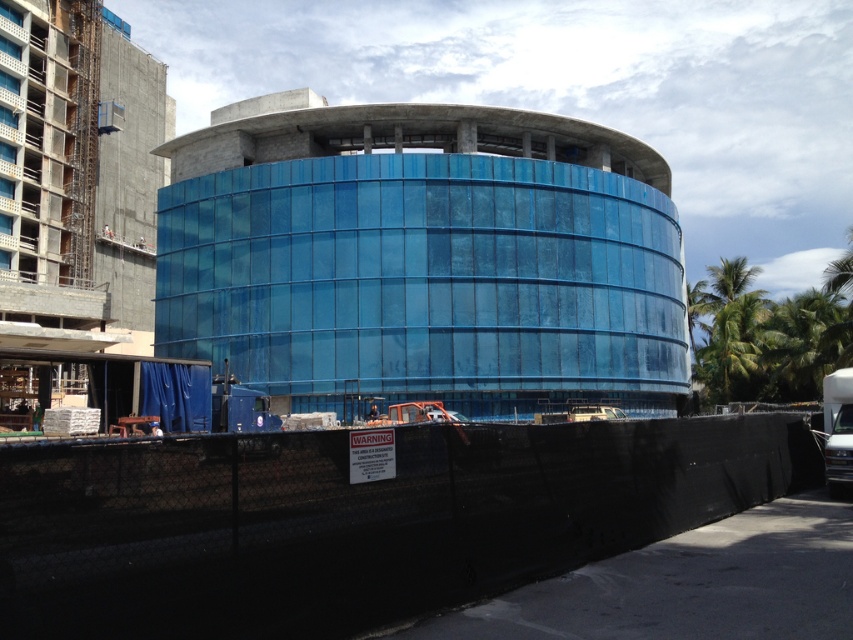
You are a delivery driver approaching the construction site. You need to determine if you can see the transparent glass building at center through the black mesh fence at lower center from your current position. Can you see it?

The black mesh fence at lower center is behind the transparent glass building at center, so yes, you can see the transparent glass building at center through the black mesh fence at lower center from your current position.

You are a drone operator trying to capture a photo of the transparent glass building at center and the green leafy palm tree at right from above. Which object will appear larger in the photo?

The transparent glass building at center will appear larger in the photo because it is closer to the viewer than the green leafy palm tree at right.

You are a delivery driver with a truck that requires a 25 meter turning radius. You need to turn around your truck near the transparent glass building at center and the green leafy palm tree at right. Is there enough space between them for your truck to make the turn?

The distance between the transparent glass building at center and the green leafy palm tree at right is 24.62 meters. Since the required turning radius is 25 meters, there is insufficient space for the truck to make the turn.